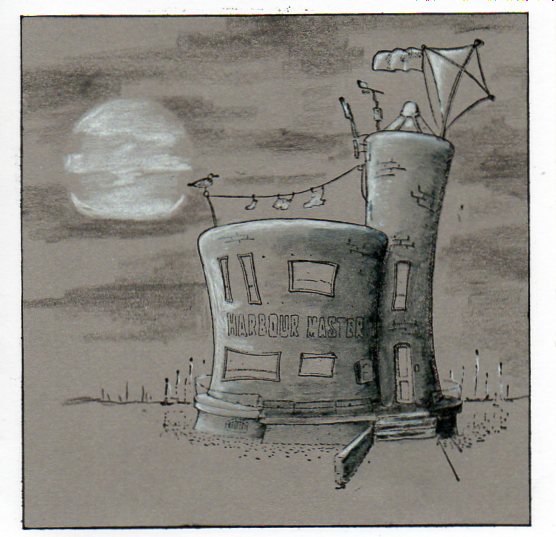
Image resolution: width=556 pixels, height=537 pixels. I want to click on wall, so click(x=342, y=464).